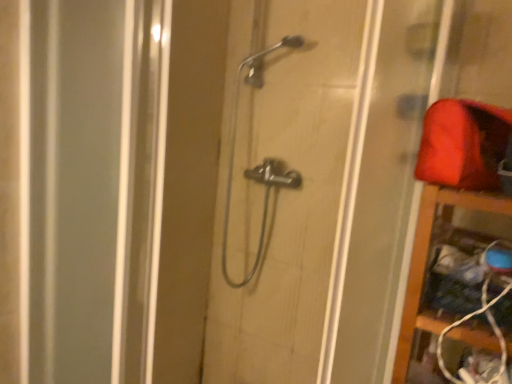
Question: Looking at the image, does wooden shelf at right seem bigger or smaller compared to metallic showerhead at center?

Choices:
 (A) small
 (B) big

Answer: (A)

Question: From their relative heights in the image, would you say wooden shelf at right is taller or shorter than metallic showerhead at center?

Choices:
 (A) tall
 (B) short

Answer: (B)

Question: Which object is the farthest from the wooden shelf at right?

Choices:
 (A) matte red fabric at upper right
 (B) metallic showerhead at center
 (C) polished chrome shower at center

Answer: (C)

Question: Estimate the real-world distances between objects in this image. Which object is closer to the polished chrome shower at center?

Choices:
 (A) metallic showerhead at center
 (B) wooden shelf at right
 (C) matte red fabric at upper right

Answer: (A)